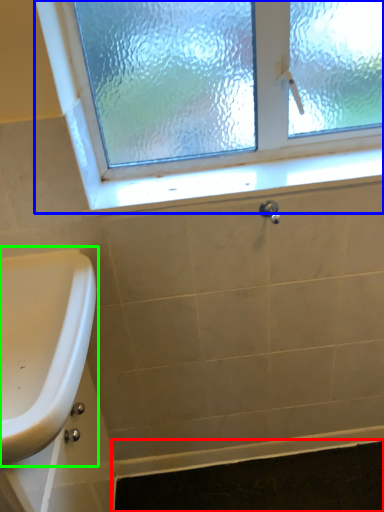
Question: Based on their relative distances, which object is nearer to bath mat (highlighted by a red box)? Choose from window (highlighted by a blue box) and sink (highlighted by a green box).

Choices:
 (A) window
 (B) sink

Answer: (B)